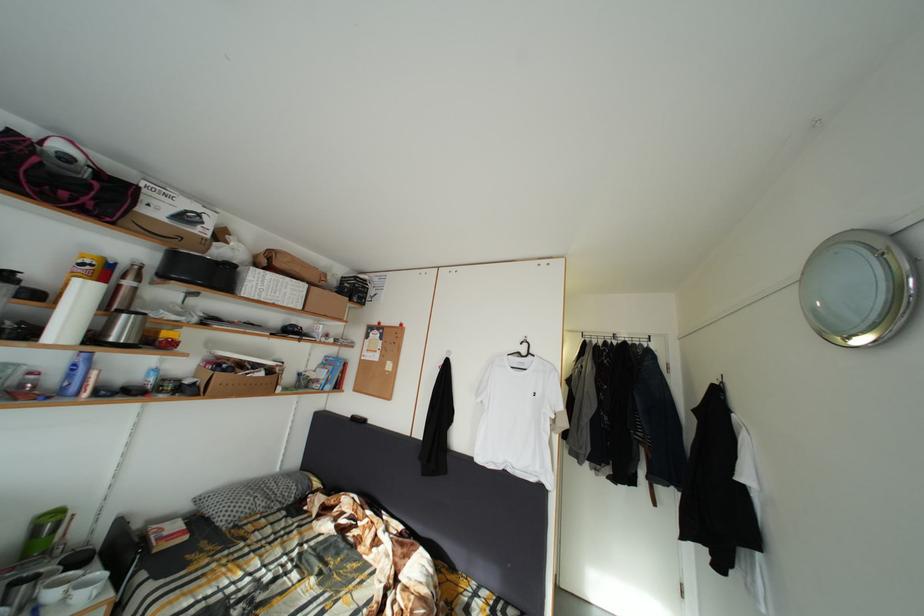
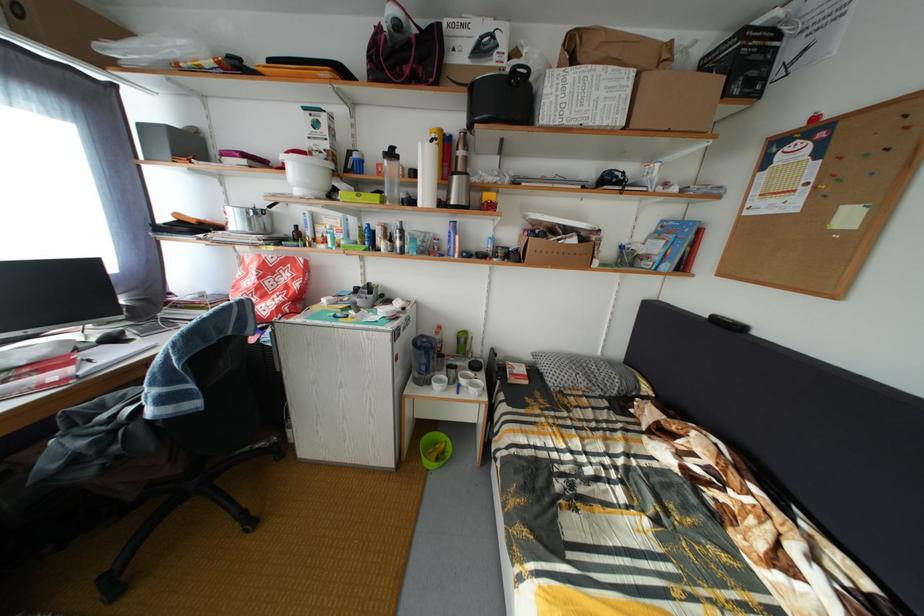
The point at (132, 322) is marked in the first image. Where is the corresponding point in the second image?

(464, 184)